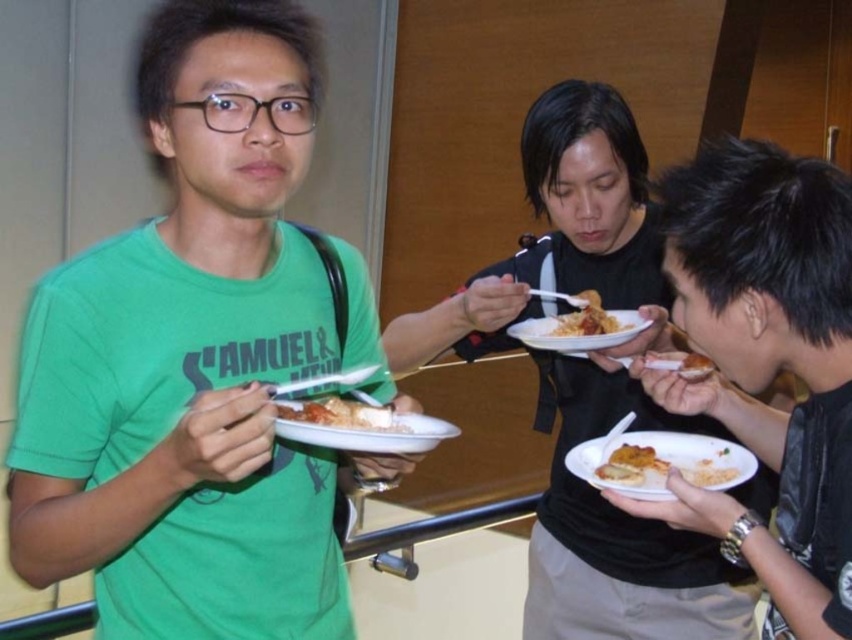
Question: Which object is positioned farthest from the shiny plastic fork at center?

Choices:
 (A) black matte shirt at center
 (B) golden crispy bread at center

Answer: (B)

Question: Does black matte shirt at center have a smaller size compared to white matte pasta at center?

Choices:
 (A) yes
 (B) no

Answer: (B)

Question: Which point is farther to the camera?

Choices:
 (A) (680, 369)
 (B) (728, 452)
 (C) (187, 236)
 (D) (447, 433)

Answer: (A)

Question: Is green matte t-shirt at left to the right of white matte plate at center from the viewer's perspective?

Choices:
 (A) yes
 (B) no

Answer: (B)

Question: Does white matte pasta at center appear under shiny plastic fork at center?

Choices:
 (A) no
 (B) yes

Answer: (B)

Question: Based on their relative distances, which object is nearer to the white paper plate at center?

Choices:
 (A) white matte pasta at center
 (B) golden crispy bread at center
 (C) green matte t-shirt at left
 (D) shiny plastic fork at center

Answer: (A)